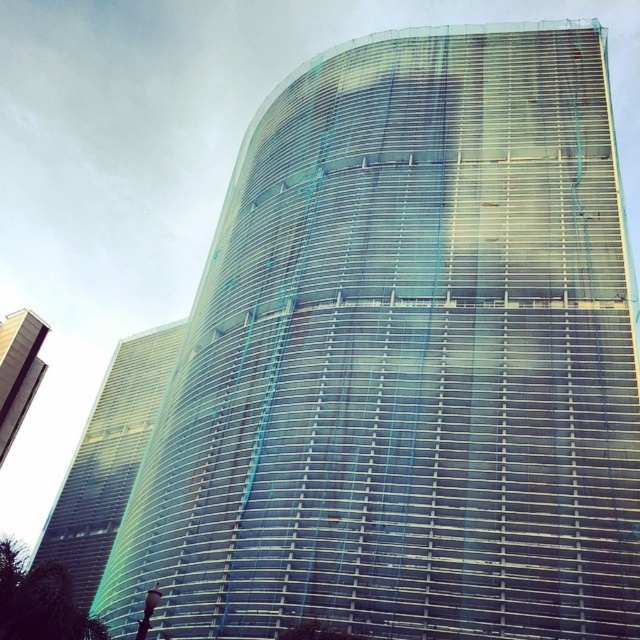
You are standing at the base of the curved skyscraper and looking upward. There are two points marked on the building facade. One is labeled as point [128,346] and the other as point [3,428]. Which point do you see first as you look upward from the base?

Point [3,428] is closer to you than point [128,346], so you will see point [3,428] first as you look upward from the base.

Consider the image. You are an architect evaluating two glass buildings in the city. You need to determine which one is taller between the transparent glass building at center and the clear glass building at upper left. Based on the scene, which building is taller?

The transparent glass building at center is taller than the clear glass building at upper left.

You are standing at the point marked by point [108,458] in the image. What can you see directly in front of you?

You can see the transparent glass building at center directly in front of you, as the point marks its location.